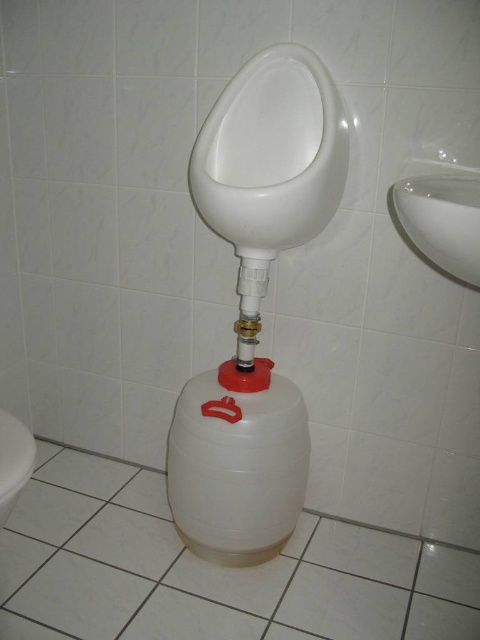
You are a plumber inspecting a bathroom and see the white matte bidet at upper center and the white glossy sink at upper right. Which object has a greater width?

The white matte bidet at upper center has a greater width than the white glossy sink at upper right.